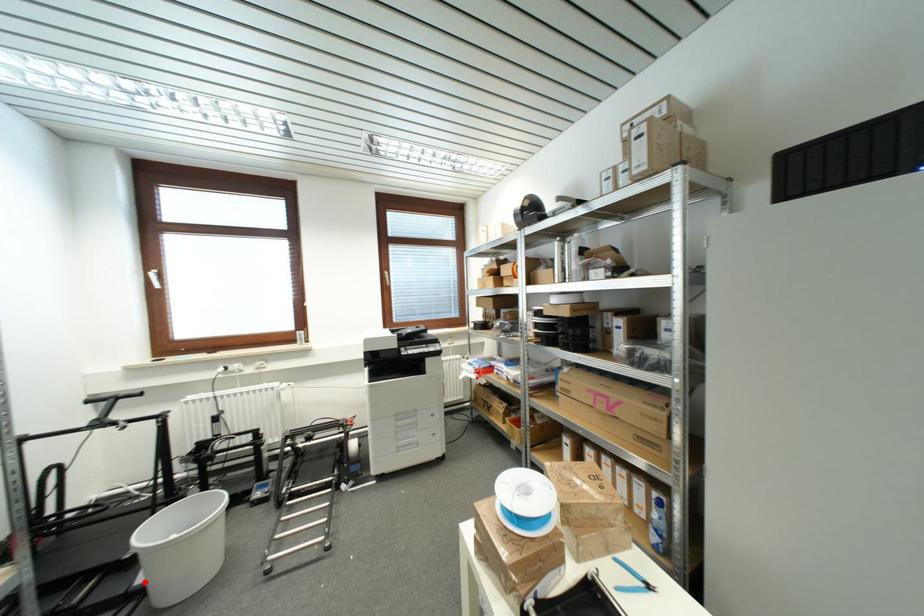
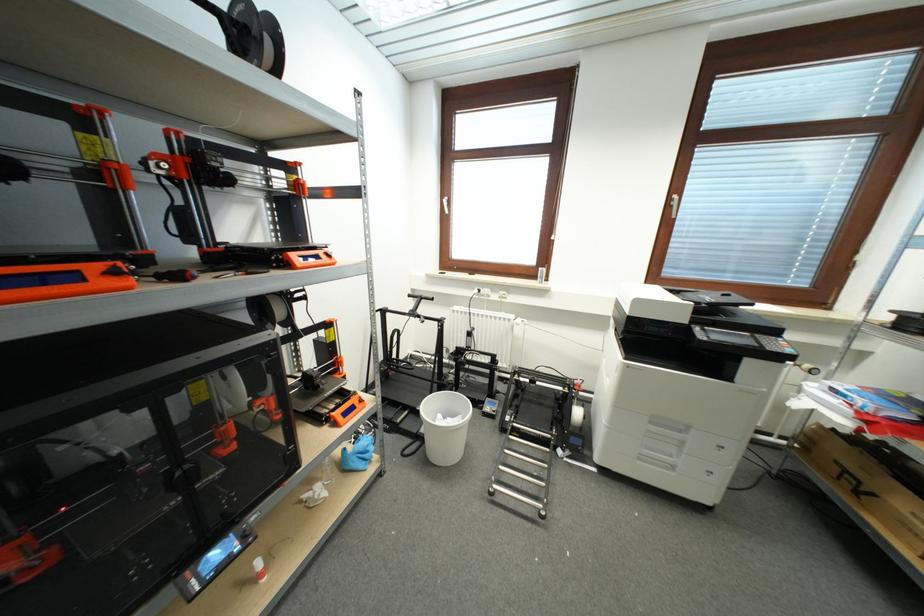
Question: I am providing you with two images of the same scene from different viewpoints. A red point is marked on the first image. Is the red point's position out of view in image 2?

Choices:
 (A) Yes
 (B) No

Answer: (B)